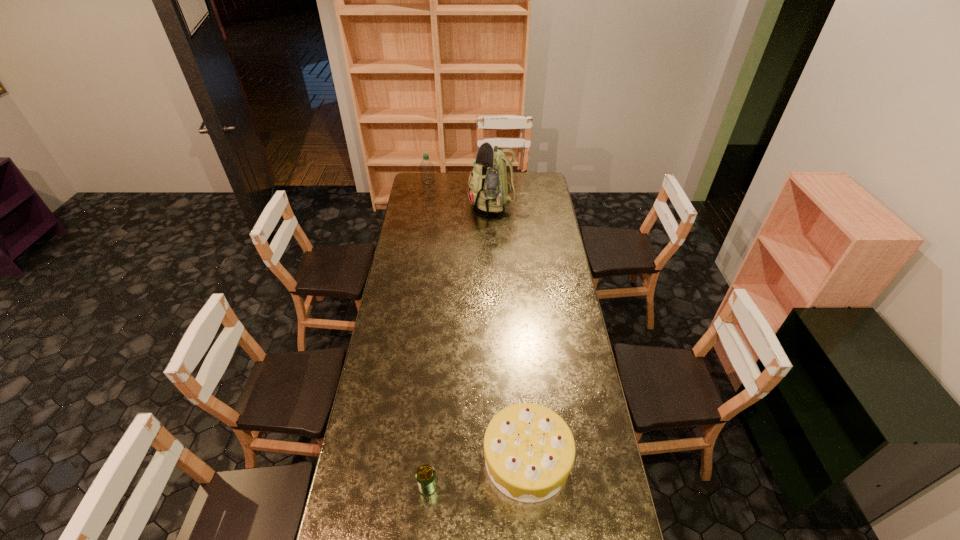
Find the location of a particular element. the third nearest object is located at coordinates (488, 188).

The width and height of the screenshot is (960, 540). What are the coordinates of `backpack` in the screenshot? It's located at (488, 188).

I want to click on the farthest object, so click(426, 167).

Where is `water bottle`? The height and width of the screenshot is (540, 960). water bottle is located at coordinates (426, 167).

Locate an element on the screen. birthday cake is located at coordinates (529, 450).

The image size is (960, 540). What are the coordinates of `beer can` in the screenshot? It's located at (426, 479).

At what (x,y) coordinates should I click in order to perform the action: click on the shortest object. Please return your answer as a coordinate pair (x, y). The image size is (960, 540). Looking at the image, I should click on (426, 479).

Where is `vacant space located on the front-facing side of the tallest object`? The image size is (960, 540). vacant space located on the front-facing side of the tallest object is located at coordinates (421, 205).

At what (x,y) coordinates should I click in order to perform the action: click on vacant region located 0.070m on the front-facing side of the tallest object. Please return your answer as a coordinate pair (x, y). Image resolution: width=960 pixels, height=540 pixels. Looking at the image, I should click on (456, 205).

What are the coordinates of `free space located 0.180m on the front-facing side of the tallest object` in the screenshot? It's located at (439, 205).